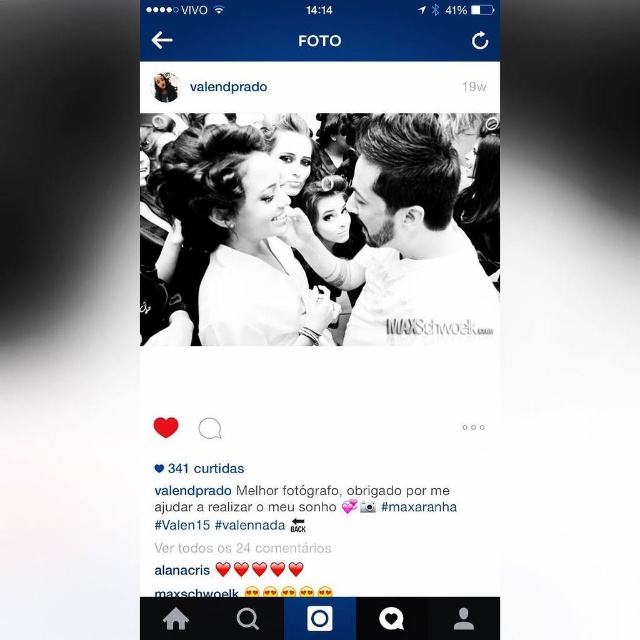
Between white matte dress at center and white matte text at center, which one appears on the left side from the viewer's perspective?

white matte dress at center

Does white matte dress at center have a greater height compared to white matte text at center?

Indeed, white matte dress at center has a greater height compared to white matte text at center.

At what (x,y) coordinates should I click in order to perform the action: click on white matte dress at center. Please return your answer as a coordinate pair (x, y). Image resolution: width=640 pixels, height=640 pixels. Looking at the image, I should click on (x=323, y=244).

This screenshot has height=640, width=640. I want to click on white matte dress at center, so click(x=323, y=244).

Who is more distant from viewer, (259, 296) or (285, 196)?

Positioned behind is point (259, 296).

Can you confirm if white matte dress at center is thinner than matte white hair at center?

No.

The width and height of the screenshot is (640, 640). What are the coordinates of `white matte dress at center` in the screenshot? It's located at (323, 244).

Between point (204, 134) and point (445, 500), which one is positioned behind?

Positioned behind is point (204, 134).

Does matte white hair at center come in front of white matte text at center?

No, matte white hair at center is behind white matte text at center.

Is point (220, 310) in front of point (401, 508)?

No.

Find the location of a particular element. The image size is (640, 640). matte white hair at center is located at coordinates (237, 240).